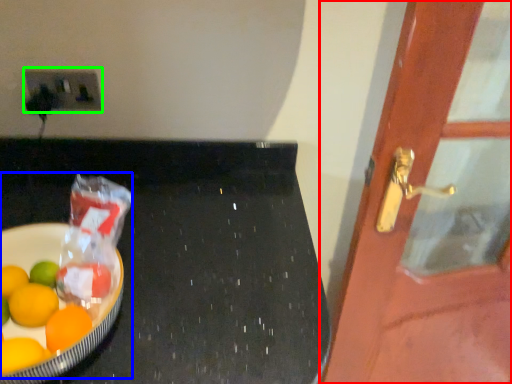
Question: Estimate the real-world distances between objects in this image. Which object is farther from door (highlighted by a red box), fruit dish (highlighted by a blue box) or electric outlet (highlighted by a green box)?

Choices:
 (A) fruit dish
 (B) electric outlet

Answer: (B)